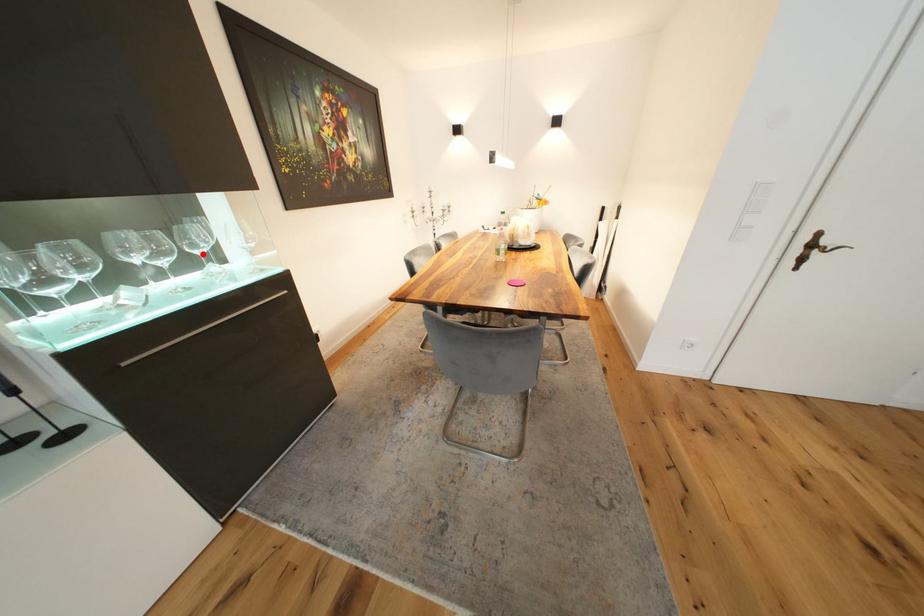
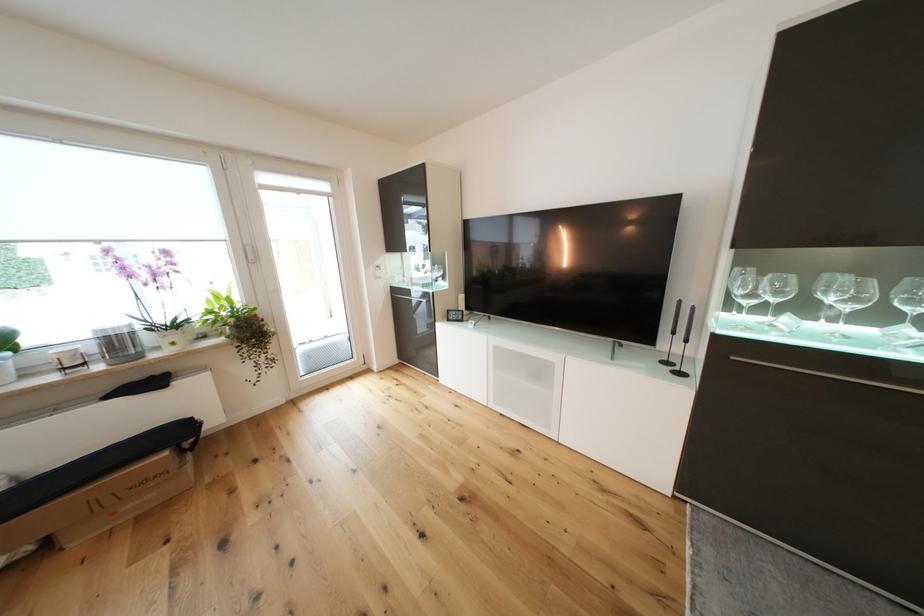
Question: I am providing you with two images of the same scene from different viewpoints. A red point is shown in image1. For the corresponding object point in image2, is it positioned nearer or farther from the camera?

Choices:
 (A) Nearer
 (B) Farther

Answer: (B)